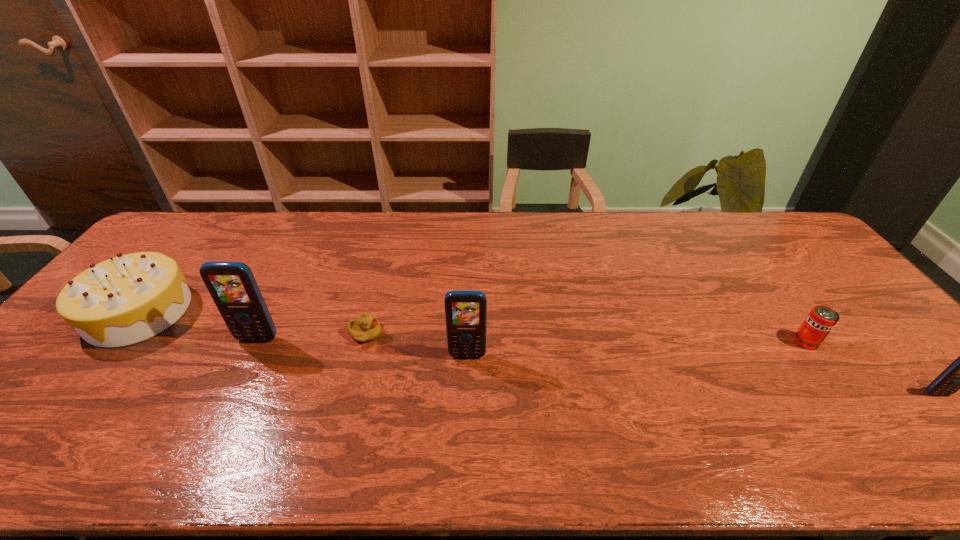
In the image, there is a desktop. In order to click on vacant space at the far edge in this screenshot , I will do `click(446, 218)`.

What are the coordinates of `vacant space at the near edge of the desktop` in the screenshot? It's located at (251, 417).

Locate an element on the screen. vacant space at the left edge is located at coordinates (55, 353).

This screenshot has width=960, height=540. In the image, there is a desktop. In order to click on vacant area at the right edge in this screenshot , I will do `click(895, 361)`.

In the image, there is a desktop. Identify the location of vacant space at the far left corner. This screenshot has width=960, height=540. (174, 221).

Where is `blank region between the third object from right to left and the fifth tallest object`? blank region between the third object from right to left and the fifth tallest object is located at coordinates (x=636, y=349).

The height and width of the screenshot is (540, 960). In order to click on empty space that is in between the shortest object and the rightmost cellular telephone in this screenshot , I will do `click(651, 363)`.

In order to click on empty space between the fifth object from right to left and the fifth object from left to right in this screenshot , I will do `click(532, 340)`.

The image size is (960, 540). Identify the location of free spot between the fifth object from right to left and the nearest object. (597, 366).

This screenshot has height=540, width=960. Find the location of `free point between the second shortest object and the fifth object from right to left`. free point between the second shortest object and the fifth object from right to left is located at coordinates (532, 340).